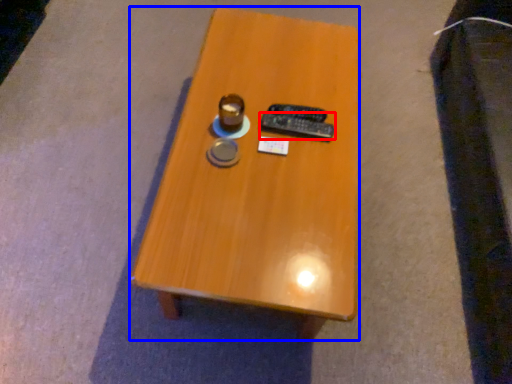
Question: Among these objects, which one is nearest to the camera, remote control (highlighted by a red box) or table (highlighted by a blue box)?

Choices:
 (A) remote control
 (B) table

Answer: (B)